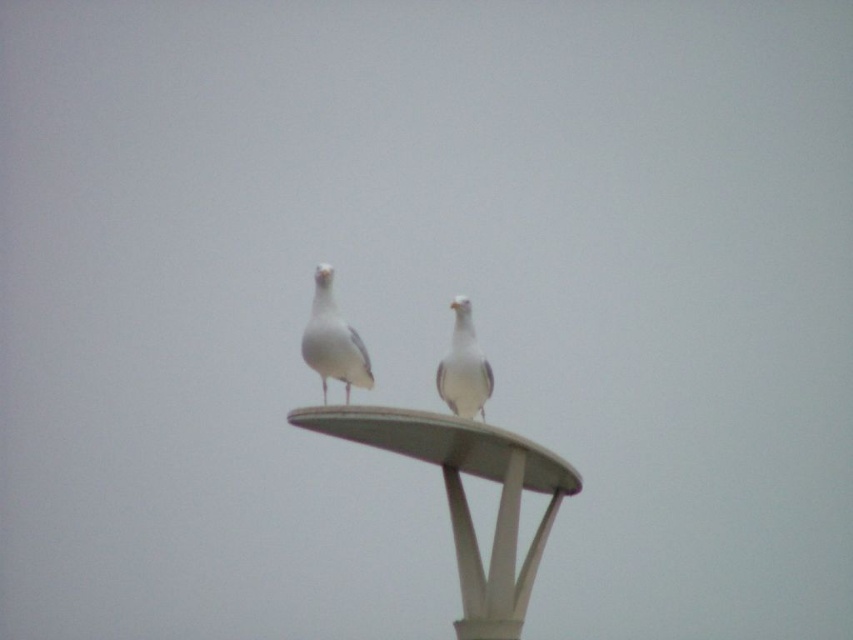
Identify the location of white matte lamp post at center. The width and height of the screenshot is (853, 640). (463, 497).

Can you confirm if white matte lamp post at center is positioned below white feathered bird at center?

Yes.

Is point (474, 554) behind point (444, 372)?

No, it is not.

Identify the location of white matte lamp post at center. The width and height of the screenshot is (853, 640). (463, 497).

Between white matte bird at center and white feathered bird at center, which one is positioned higher?

white matte bird at center

Which is behind, point (309, 348) or point (450, 364)?

Point (450, 364)

I want to click on white matte bird at center, so click(x=334, y=340).

Can you confirm if white matte lamp post at center is thinner than white matte bird at center?

No, white matte lamp post at center is not thinner than white matte bird at center.

Does white matte lamp post at center have a lesser height compared to white matte bird at center?

No, white matte lamp post at center is not shorter than white matte bird at center.

Does point (537, 484) lie behind point (334, 337)?

Yes, point (537, 484) is behind point (334, 337).

You are a GUI agent. You are given a task and a screenshot of the screen. Output one action in this format:
    pyautogui.click(x=<x>, y=<y>)
    Task: Click on the white matte lamp post at center
    The width and height of the screenshot is (853, 640).
    Given the screenshot: What is the action you would take?
    pyautogui.click(x=463, y=497)